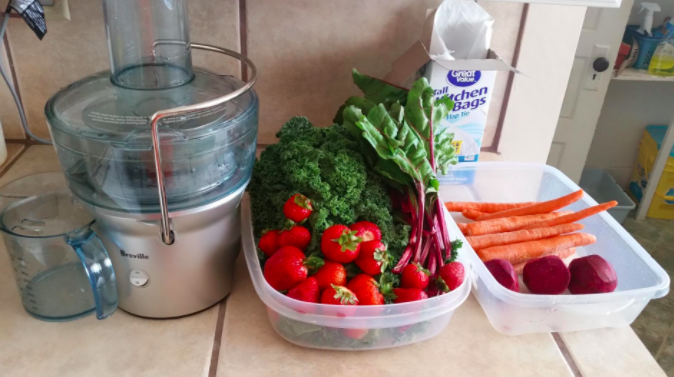
Find the location of a particular element. The width and height of the screenshot is (674, 377). food processor is located at coordinates coord(160,246).